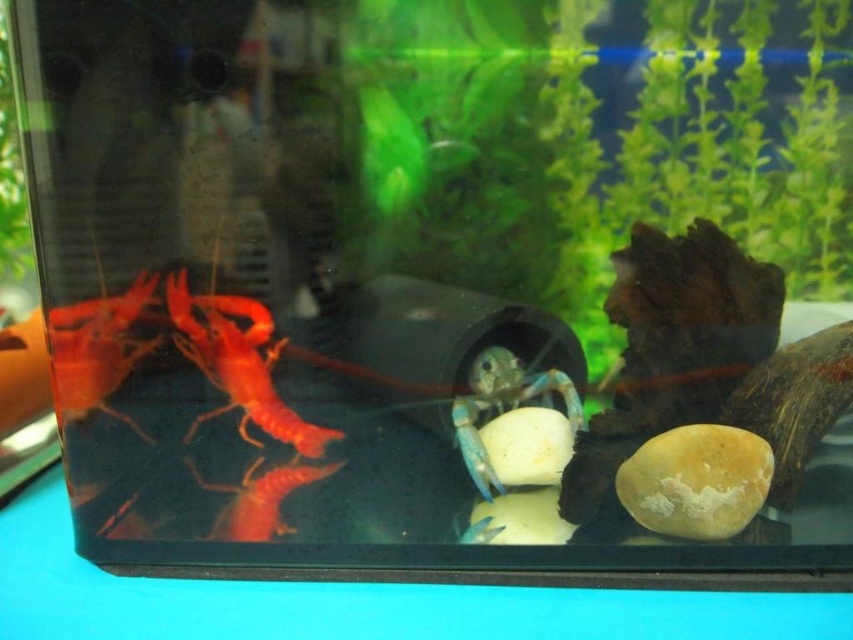
Does blue translucent crab at center lie behind translucent red shrimp at lower center?

No.

The width and height of the screenshot is (853, 640). Describe the element at coordinates (503, 404) in the screenshot. I see `blue translucent crab at center` at that location.

Where is `blue translucent crab at center`? blue translucent crab at center is located at coordinates (503, 404).

Which is in front, point (64, 419) or point (520, 397)?

Point (64, 419) is in front.

What do you see at coordinates (97, 349) in the screenshot? This screenshot has width=853, height=640. I see `matte red shrimp at left` at bounding box center [97, 349].

Where is `matte red shrimp at left`? The height and width of the screenshot is (640, 853). matte red shrimp at left is located at coordinates (97, 349).

Between matte red lobster at center and blue translucent crab at center, which one is positioned higher?

Positioned higher is matte red lobster at center.

Is point (247, 417) more distant than point (525, 385)?

No, (247, 417) is closer to viewer.

I want to click on matte red lobster at center, so click(x=239, y=364).